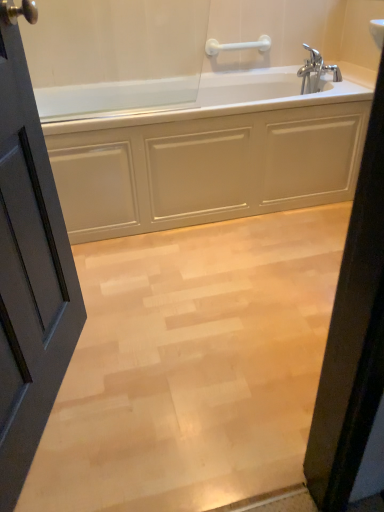
The image size is (384, 512). What are the coordinates of `vacant location behind matte gray door at left` in the screenshot? It's located at (131, 306).